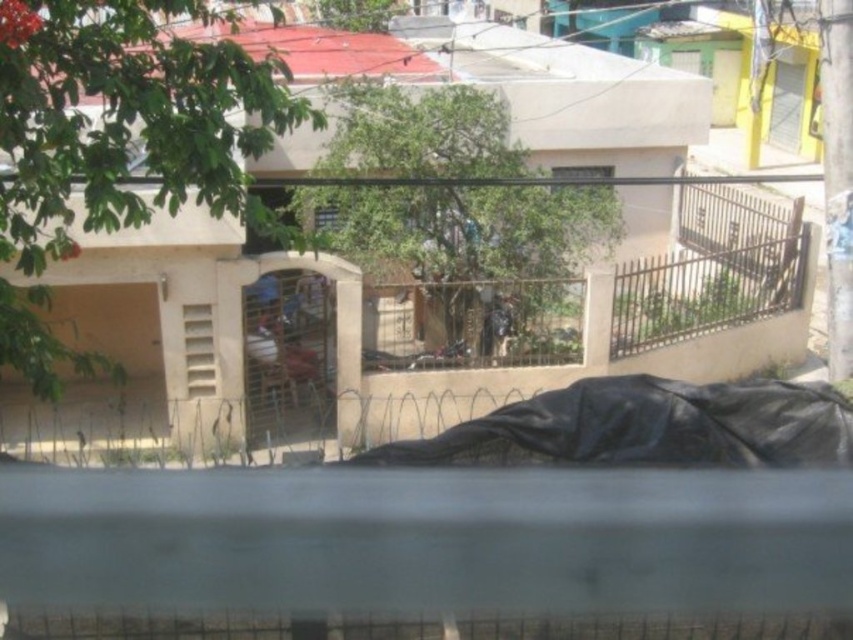
Question: Can you confirm if black tarp at center is positioned to the left of metallic wire cage at center?

Choices:
 (A) yes
 (B) no

Answer: (B)

Question: Is black tarp at center below metallic wire cage at center?

Choices:
 (A) no
 (B) yes

Answer: (B)

Question: Is black tarp at center wider than metallic wire cage at center?

Choices:
 (A) no
 (B) yes

Answer: (B)

Question: Which of the following is the closest to the observer?

Choices:
 (A) black tarp at center
 (B) metallic wire cage at center

Answer: (A)